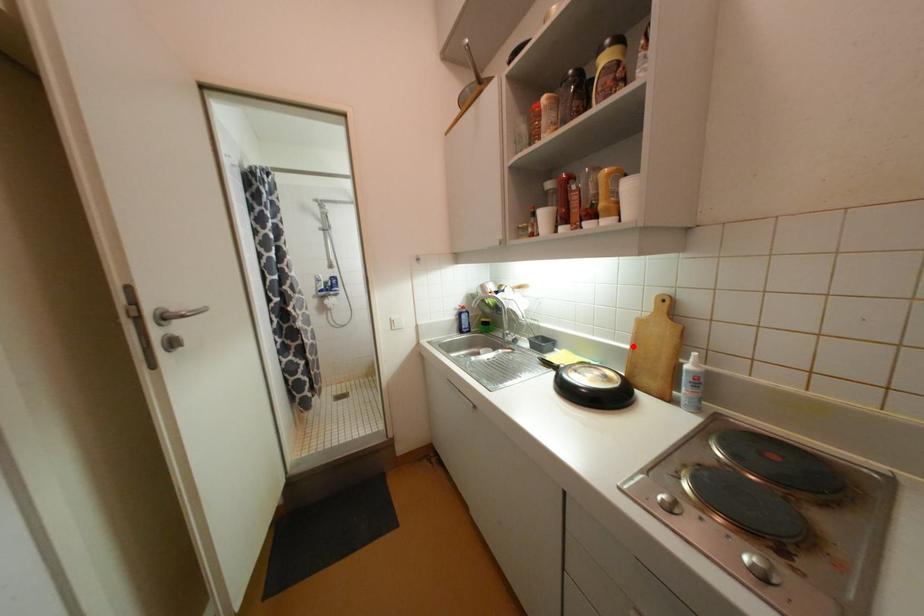
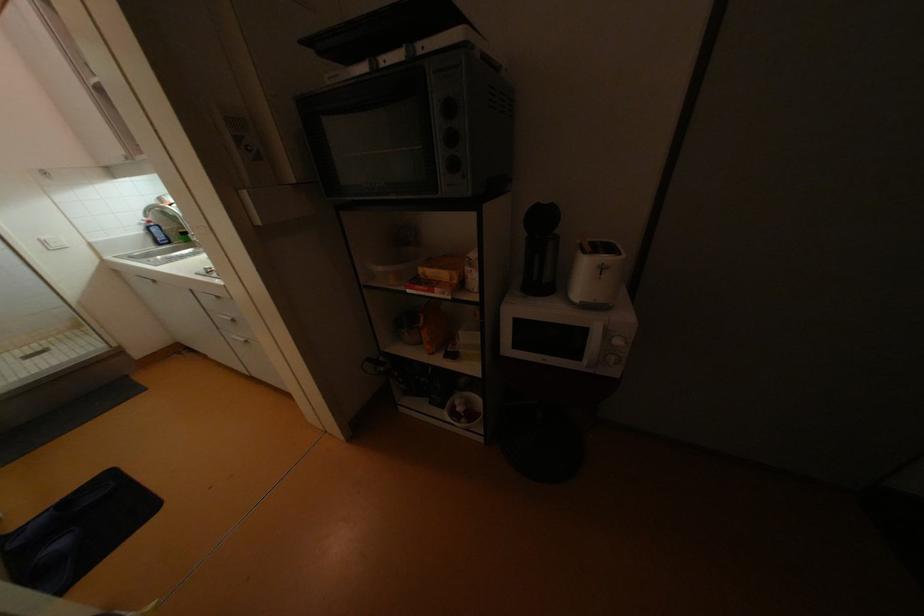
Question: I am providing you with two images of the same scene from different viewpoints. A red point is marked on the first image. Is the red point's position out of view in image 2?

Choices:
 (A) Yes
 (B) No

Answer: (A)